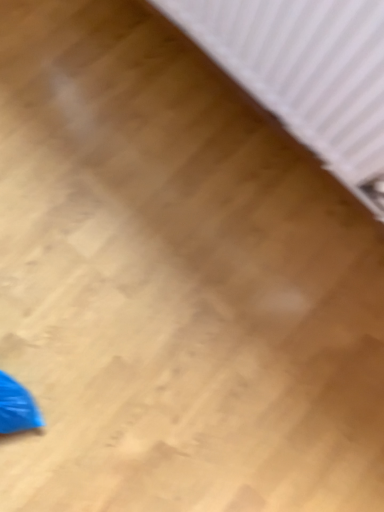
I want to click on free space that is to the left of white textured radiator at upper right, so click(x=114, y=85).